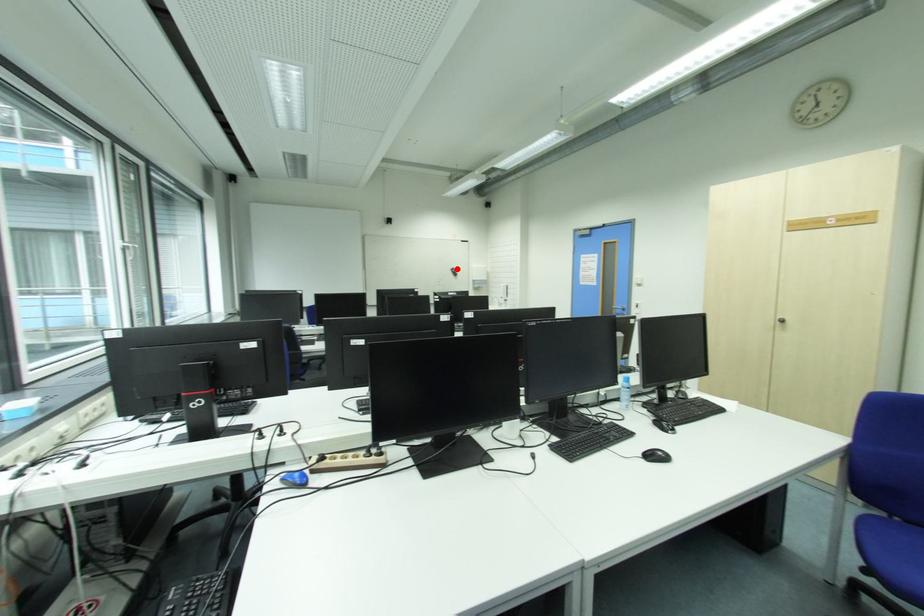
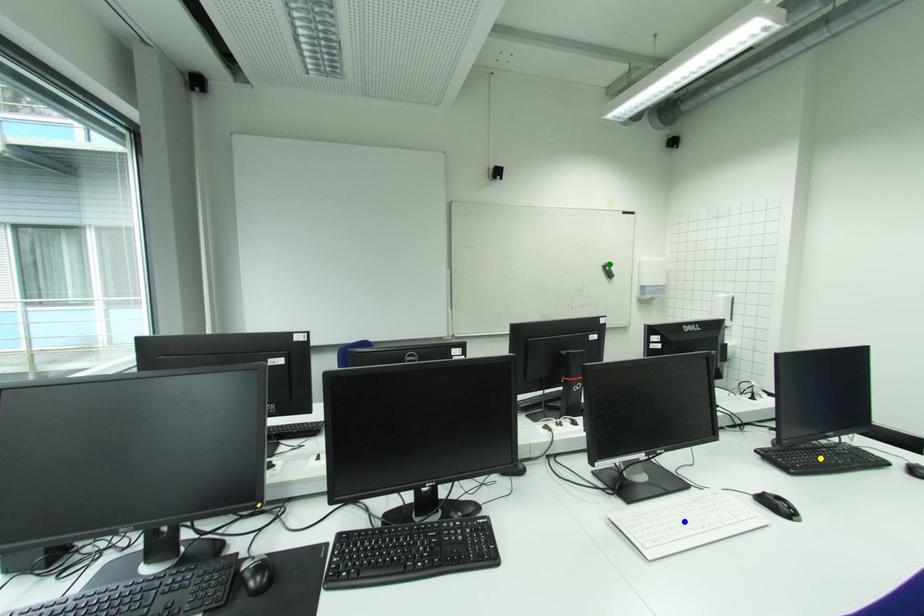
Question: I am providing you with two images of the same scene from different viewpoints. A red point is marked on the first image. You are given multiple points on the second image. Which point in image 2 represents the same 3d spot as the red point in image 1?

Choices:
 (A) yellow point
 (B) blue point
 (C) green point

Answer: (C)